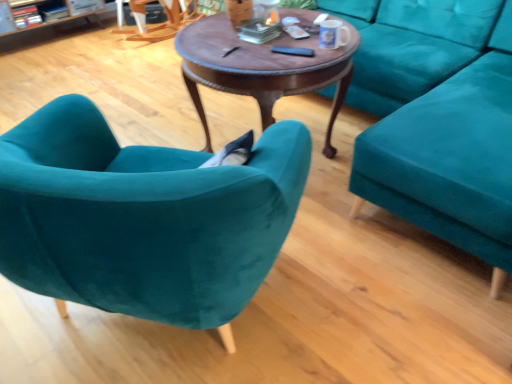
Find the location of a particular element. The height and width of the screenshot is (384, 512). unoccupied space behind white plastic remote control at center, arranged as the first remote control when viewed from the back is located at coordinates (294, 27).